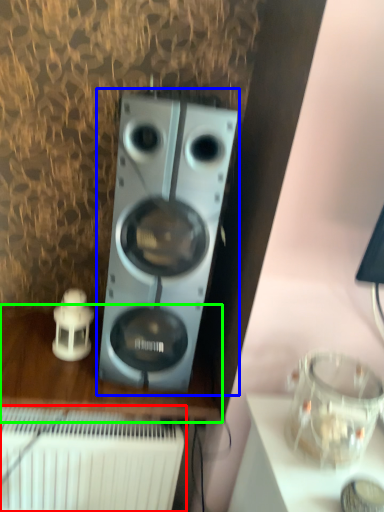
Question: Estimate the real-world distances between objects in this image. Which object is closer to radiator (highlighted by a red box), home appliance (highlighted by a blue box) or furniture (highlighted by a green box)?

Choices:
 (A) home appliance
 (B) furniture

Answer: (B)